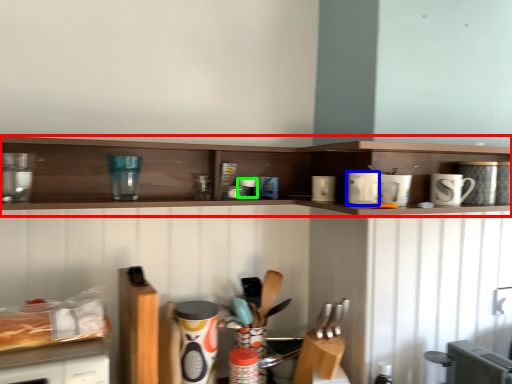
Question: Estimate the real-world distances between objects in this image. Which object is closer to shelf (highlighted by a red box), appliance (highlighted by a blue box) or appliance (highlighted by a green box)?

Choices:
 (A) appliance
 (B) appliance

Answer: (B)